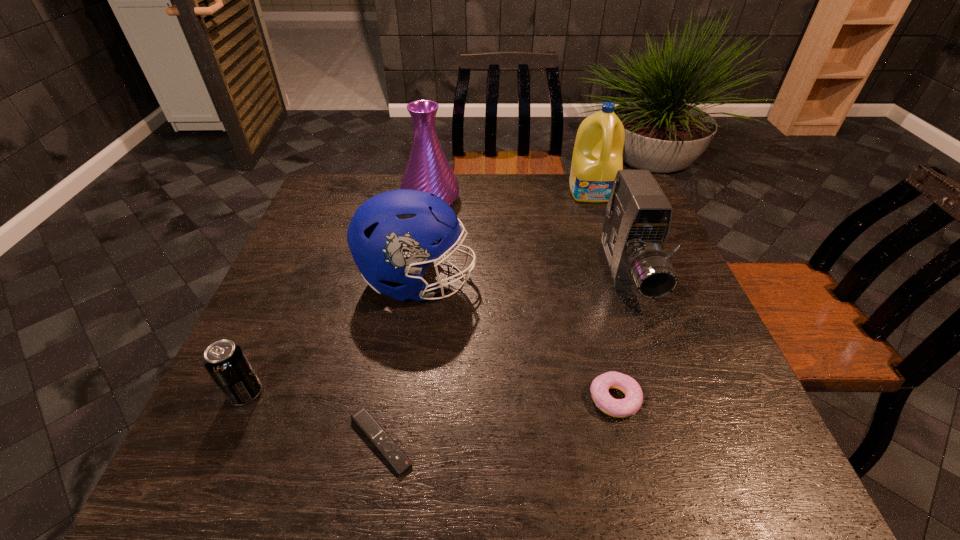
Locate an element on the screen. The height and width of the screenshot is (540, 960). vase is located at coordinates click(x=428, y=170).

This screenshot has width=960, height=540. What are the coordinates of `detergent` in the screenshot? It's located at (597, 156).

You are a GUI agent. You are given a task and a screenshot of the screen. Output one action in this format:
    pyautogui.click(x=<x>, y=<y>)
    Task: Click on the football helmet
    The width and height of the screenshot is (960, 540).
    Given the screenshot: What is the action you would take?
    pyautogui.click(x=392, y=236)

The image size is (960, 540). I want to click on camcorder, so click(637, 222).

Locate an element on the screen. This screenshot has width=960, height=540. soda can is located at coordinates (225, 361).

At what (x,y) coordinates should I click in order to perform the action: click on the leftmost object. Please return your answer as a coordinate pair (x, y). This screenshot has height=540, width=960. Looking at the image, I should click on (225, 361).

In order to click on doughnut in this screenshot , I will do `click(620, 408)`.

I want to click on remote control, so click(393, 454).

Where is `vacant space located on the left of the vase`? Image resolution: width=960 pixels, height=540 pixels. vacant space located on the left of the vase is located at coordinates (386, 200).

Identify the location of vacant space positioned 0.200m on the label of the detergent. The image size is (960, 540). (612, 245).